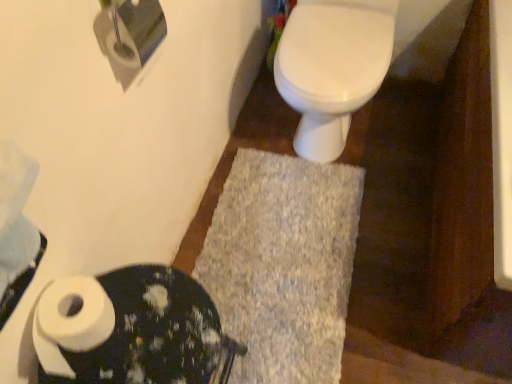
Where is `vacant region below gray shaggy bath mat at center (from a real-world perspective)`? vacant region below gray shaggy bath mat at center (from a real-world perspective) is located at coordinates (293, 249).